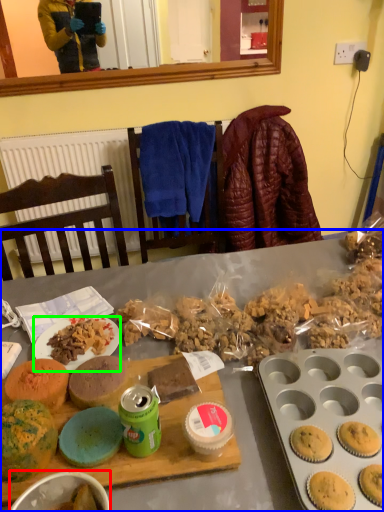
Question: Which is farther away from bowl (highlighted by a red box)? desk (highlighted by a blue box) or plate (highlighted by a green box)?

Choices:
 (A) desk
 (B) plate

Answer: (A)